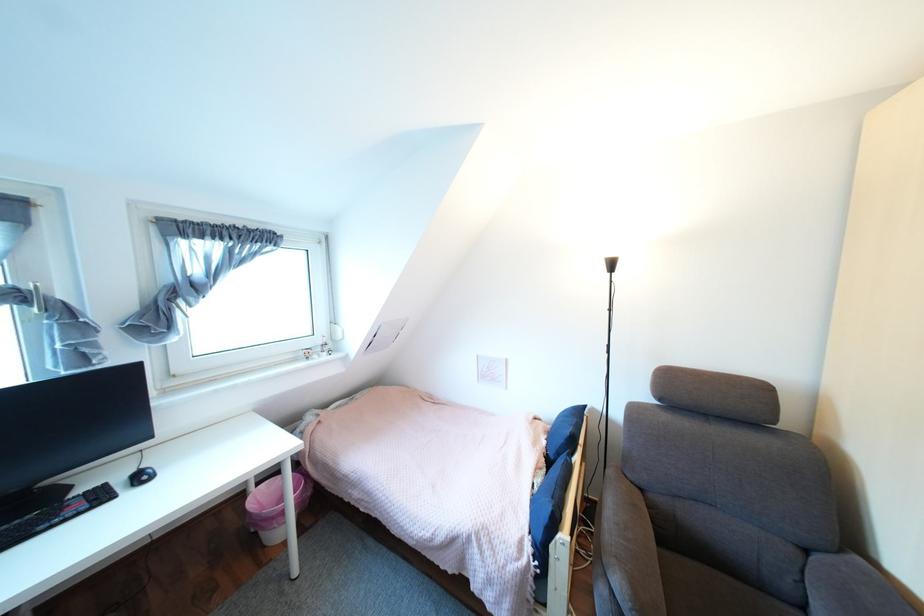
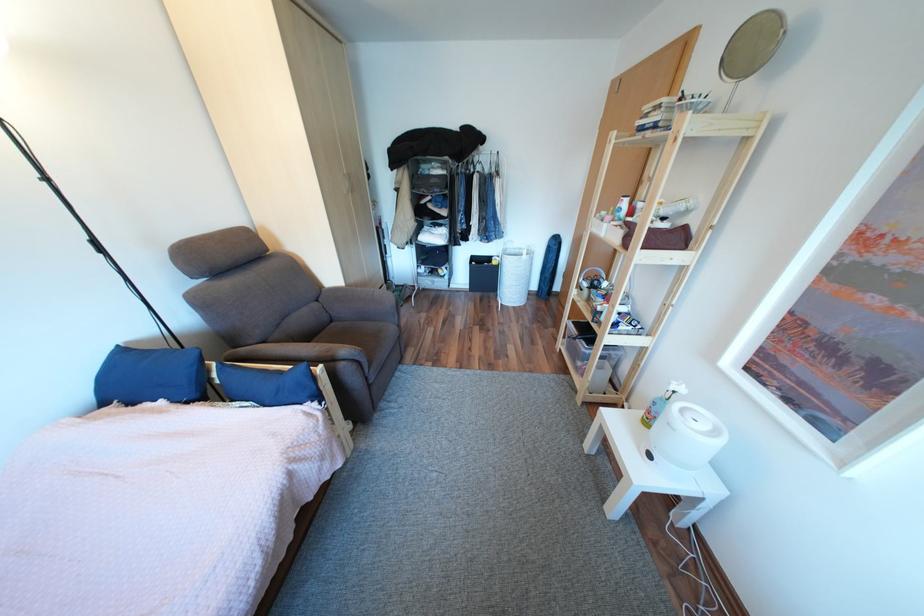
Find the pixel in the second image that matches (563,456) in the first image.

(205, 395)